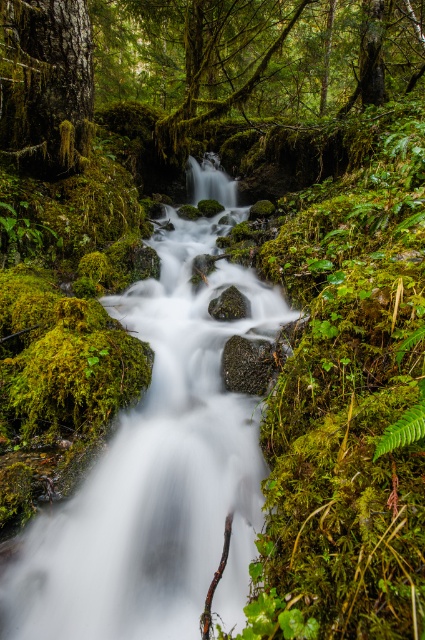
Question: Which object appears farthest from the camera in this image?

Choices:
 (A) rough textured rock at center
 (B) white smooth stream at center

Answer: (A)

Question: Among these objects, which one is nearest to the camera?

Choices:
 (A) green mossy rock at center
 (B) rough textured rock at center
 (C) white smooth stream at center

Answer: (C)

Question: Where is white smooth stream at center located in relation to rough textured rock at center in the image?

Choices:
 (A) below
 (B) above

Answer: (A)

Question: Can you confirm if green mossy tree trunk at upper left is bigger than green mossy rock at center?

Choices:
 (A) no
 (B) yes

Answer: (B)

Question: Can you confirm if white smooth stream at center is thinner than green mossy tree trunk at upper left?

Choices:
 (A) no
 (B) yes

Answer: (A)

Question: Which object is the closest to the green mossy rock at center?

Choices:
 (A) white smooth stream at center
 (B) green mossy tree trunk at upper left

Answer: (A)